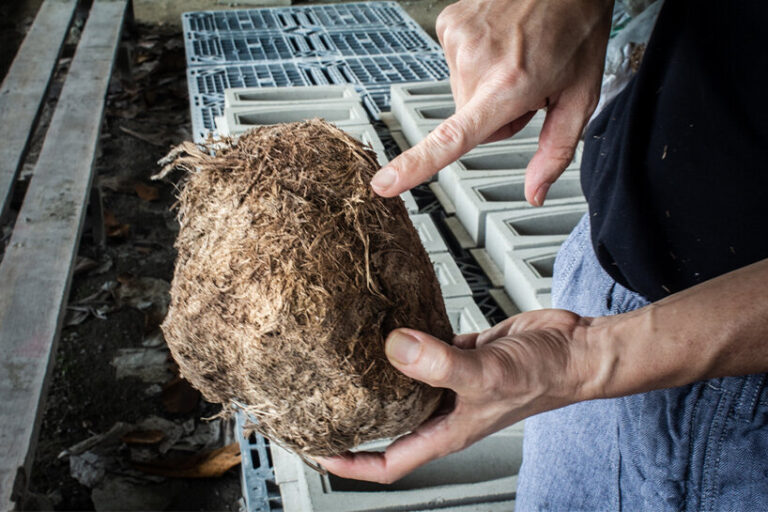
Where is `wooden planks`? This screenshot has height=512, width=768. wooden planks is located at coordinates (20, 110), (67, 154).